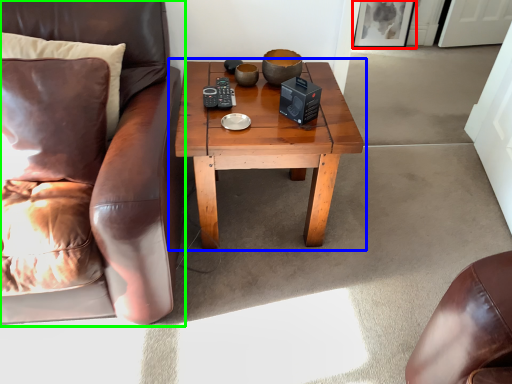
Question: Based on their relative distances, which object is nearer to picture frame (highlighted by a red box)? Choose from coffee table (highlighted by a blue box) and chair (highlighted by a green box).

Choices:
 (A) coffee table
 (B) chair

Answer: (A)